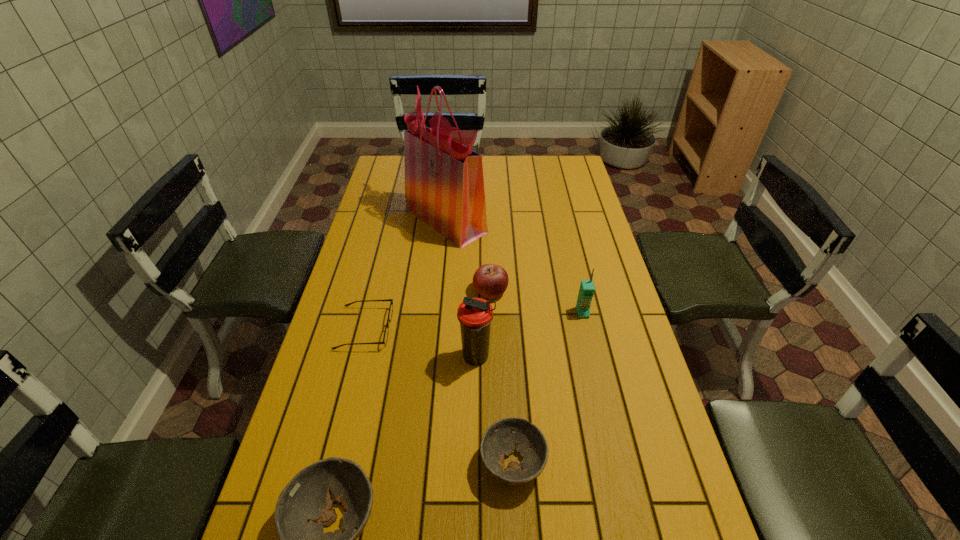
You are a GUI agent. You are given a task and a screenshot of the screen. Output one action in this format:
    pyautogui.click(x=<x>, y=<y>)
    Task: Click on the vacant region that satisfies the following two spatial constraints: 1. on the keypad of the third tallest object; 2. on the front-facing side of the shortest object
    The width and height of the screenshot is (960, 540).
    Given the screenshot: What is the action you would take?
    pyautogui.click(x=586, y=328)

This screenshot has height=540, width=960. I want to click on free space that satisfies the following two spatial constraints: 1. on the front side of the farthest object; 2. on the left side of the second farthest object, so click(440, 291).

This screenshot has height=540, width=960. I want to click on free spot that satisfies the following two spatial constraints: 1. on the keypad of the rightmost object; 2. on the front-facing side of the shortest object, so click(586, 328).

This screenshot has width=960, height=540. I want to click on blank area in the image that satisfies the following two spatial constraints: 1. on the front side of the second tallest object; 2. on the right side of the right bowl, so click(x=476, y=463).

Locate an element on the screen. The image size is (960, 540). vacant point that satisfies the following two spatial constraints: 1. on the front-facing side of the spectacles; 2. on the back side of the sixth tallest object is located at coordinates (331, 463).

The width and height of the screenshot is (960, 540). Identify the location of vacant area in the image that satisfies the following two spatial constraints: 1. on the front-facing side of the spectacles; 2. on the left side of the thermos bottle. (357, 357).

The image size is (960, 540). What are the coordinates of `blank space that satisfies the following two spatial constraints: 1. on the front-facing side of the right bowl; 2. on the right side of the shortest object` in the screenshot? It's located at (331, 463).